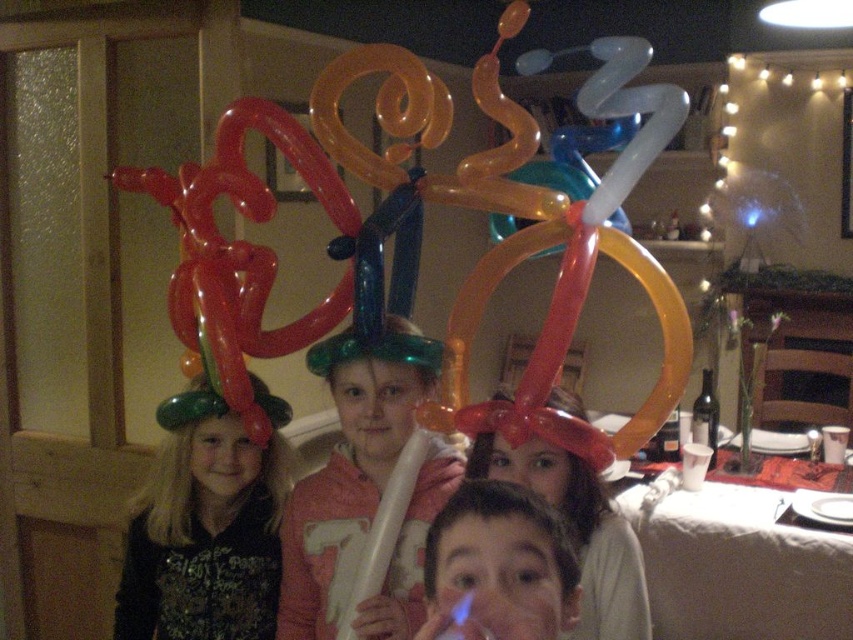
Question: Among these objects, which one is farthest from the camera?

Choices:
 (A) matte balloon hat at center
 (B) translucent plastic balloon at center

Answer: (B)

Question: Does green matte balloon hat at upper left have a larger size compared to translucent plastic balloon at center?

Choices:
 (A) yes
 (B) no

Answer: (A)

Question: Estimate the real-world distances between objects in this image. Which object is closer to the matte balloon hat at center?

Choices:
 (A) green matte balloon hat at upper left
 (B) translucent plastic balloon at center

Answer: (B)

Question: Is translucent plastic balloon at center below matte balloon hat at center?

Choices:
 (A) yes
 (B) no

Answer: (A)

Question: Is green matte balloon hat at upper left above translucent plastic balloon at center?

Choices:
 (A) no
 (B) yes

Answer: (A)

Question: Among these points, which one is nearest to the camera?

Choices:
 (A) (413, 326)
 (B) (572, 499)

Answer: (B)